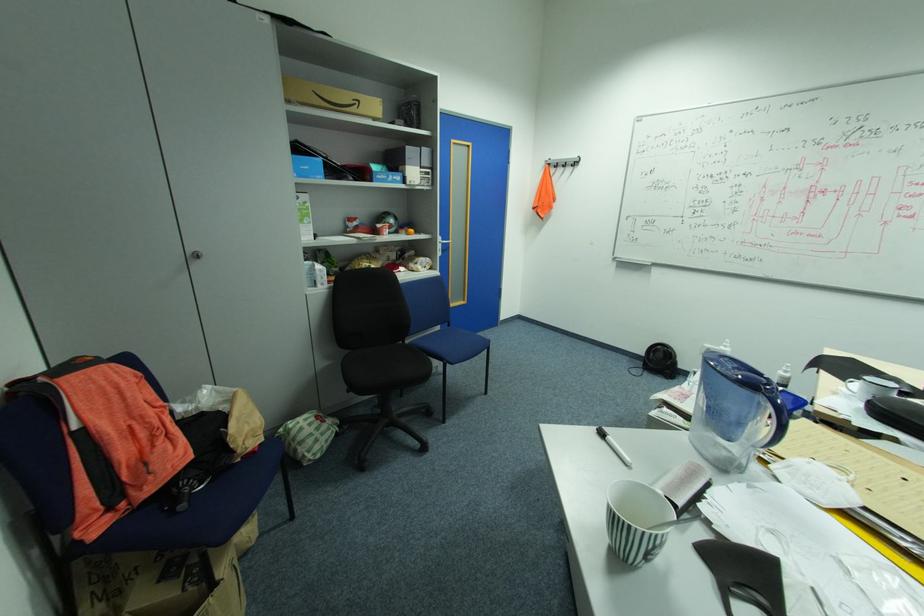
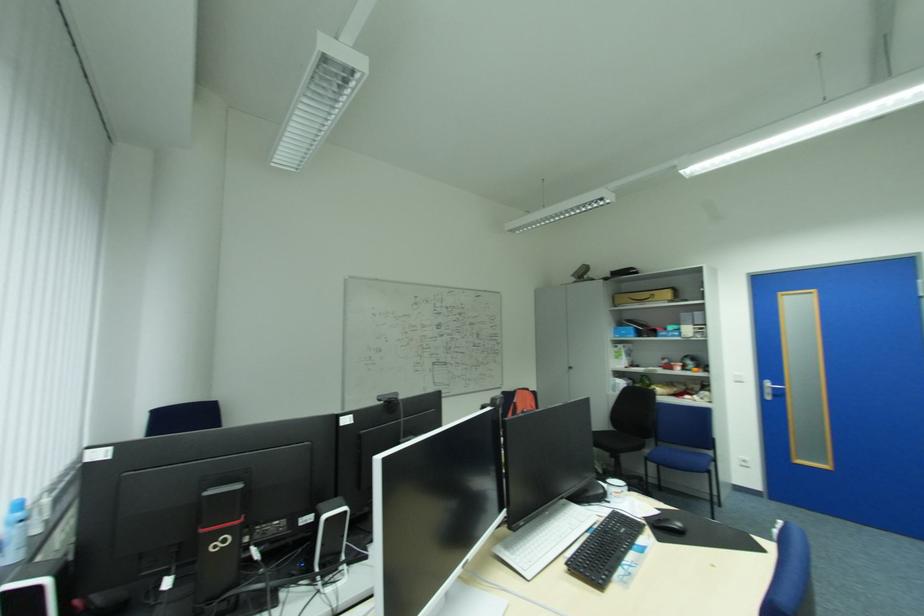
In the second image, find the point that corresponds to pixel 366 100 in the first image.

(659, 294)